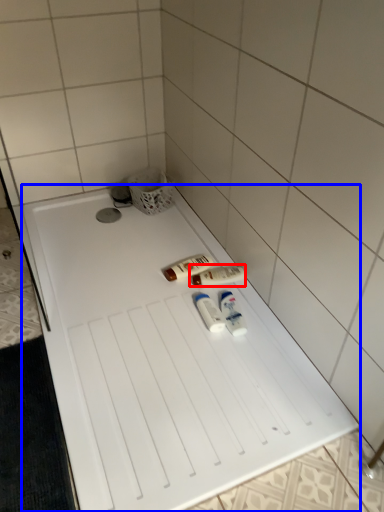
Question: Among these objects, which one is farthest to the camera, toiletry (highlighted by a red box) or furniture (highlighted by a blue box)?

Choices:
 (A) toiletry
 (B) furniture

Answer: (A)